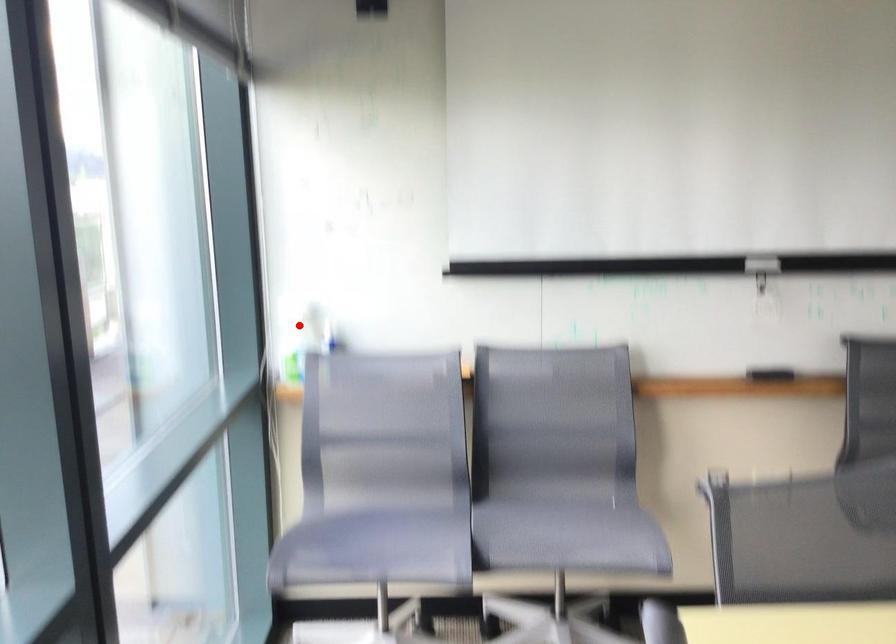
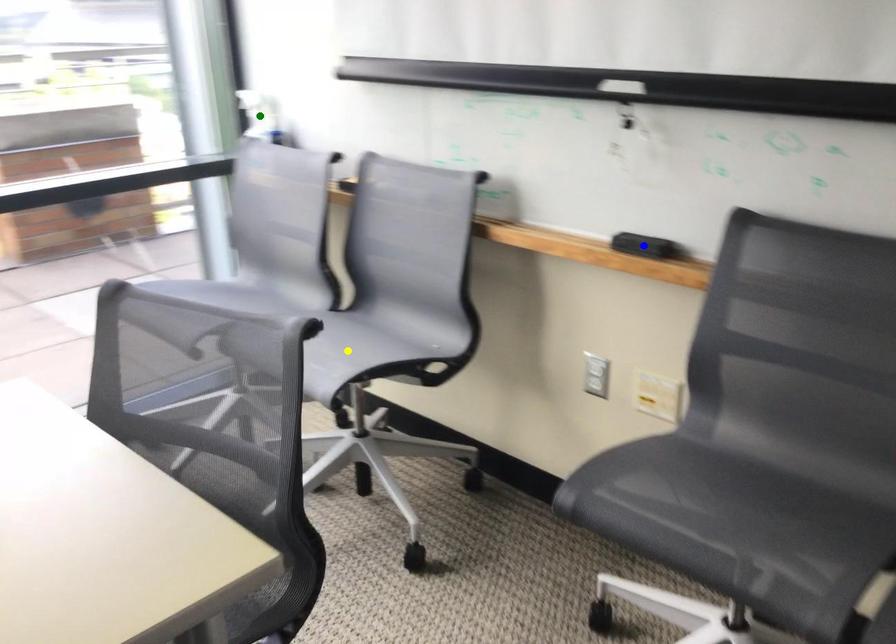
Question: I am providing you with two images of the same scene from different viewpoints. A red point is marked on the first image. You are given multiple points on the second image. Which point in image 2 is actually the same real-world point as the red point in image 1?

Choices:
 (A) yellow point
 (B) green point
 (C) blue point

Answer: (B)